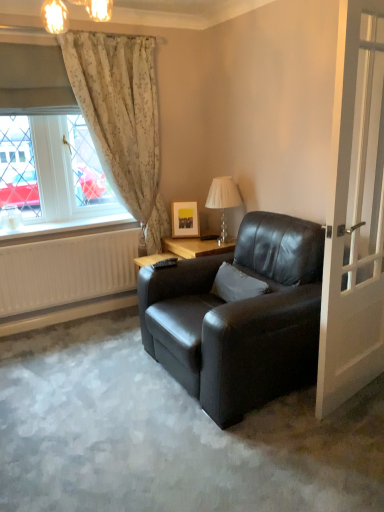
What is the approximate height of matte wooden picture frame at upper right?

12.49 inches.

You are a GUI agent. You are given a task and a screenshot of the screen. Output one action in this format:
    pyautogui.click(x=<x>, y=<y>)
    Task: Click on the matte black armchair at center
    The image size is (384, 512).
    Given the screenshot: What is the action you would take?
    pyautogui.click(x=240, y=318)

In the scene shown: Measure the distance between point (220, 193) and camera.

The distance of point (220, 193) from camera is 3.19 meters.

The width and height of the screenshot is (384, 512). Describe the element at coordinates (55, 16) in the screenshot. I see `matte glass lampshade at upper center` at that location.

This screenshot has width=384, height=512. What are the coordinates of `matte wooden picture frame at upper right` in the screenshot? It's located at (185, 220).

Which is closer to the camera, (110, 11) or (230, 298)?

Positioned in front is point (230, 298).

Can you tell me how much matte glass lampshade at upper center and white soft pillow at center differ in facing direction?

89.4 degrees separate the facing orientations of matte glass lampshade at upper center and white soft pillow at center.

Would you say matte glass lampshade at upper center is a long distance from white soft pillow at center?

Yes.

Between matte glass lampshade at upper center and white soft pillow at center, which one has more height?

Standing taller between the two is white soft pillow at center.

Would you say matte glass lampshade at upper center is a long distance from white floral curtains at upper left?

matte glass lampshade at upper center is actually quite close to white floral curtains at upper left.

Considering the positions of objects matte glass lampshade at upper center and white floral curtains at upper left in the image provided, who is behind, matte glass lampshade at upper center or white floral curtains at upper left?

white floral curtains at upper left.

Can you confirm if matte glass lampshade at upper center is taller than white floral curtains at upper left?

No.

Who is more distant, floral fabric curtain at left or matte black armchair at center?

Positioned behind is floral fabric curtain at left.

Can you tell me how much floral fabric curtain at left and matte black armchair at center differ in facing direction?

The angular difference between floral fabric curtain at left and matte black armchair at center is 90.6 degrees.

Is there a large distance between floral fabric curtain at left and matte black armchair at center?

Absolutely, floral fabric curtain at left is distant from matte black armchair at center.

Which is in front, point (156, 140) or point (304, 309)?

The point (304, 309) is closer to the camera.

What's the angular difference between matte black armchair at center and white matte radiator at lower left's facing directions?

89.9 degrees.

Could you tell me if matte black armchair at center is facing white matte radiator at lower left?

No, matte black armchair at center does not turn towards white matte radiator at lower left.

Between matte black armchair at center and white matte radiator at lower left, which one has larger width?

matte black armchair at center.

Between point (182, 374) and point (51, 247), which one is positioned in front?

The point (182, 374) is closer to the camera.

Consider the image. Can we say matte black armchair at center lies outside white glossy door at right?

Absolutely, matte black armchair at center is external to white glossy door at right.

Which object is further away from the camera taking this photo, matte black armchair at center or white glossy door at right?

matte black armchair at center is more distant.

Looking at this image, considering the relative sizes of matte black armchair at center and white glossy door at right in the image provided, is matte black armchair at center smaller than white glossy door at right?

No.

Does matte black armchair at center appear on the left side of white glossy door at right?

Yes.

Is matte wooden picture frame at upper right further to camera compared to matte glass lampshade at upper center?

Yes, matte wooden picture frame at upper right is behind matte glass lampshade at upper center.

Is matte wooden picture frame at upper right not close to matte glass lampshade at upper center?

matte wooden picture frame at upper right is positioned a significant distance from matte glass lampshade at upper center.

From the image's perspective, relative to matte glass lampshade at upper center, is matte wooden picture frame at upper right above or below?

Clearly, from the image's perspective, matte wooden picture frame at upper right is below matte glass lampshade at upper center.

From a real-world perspective, does matte wooden picture frame at upper right sit lower than matte glass lampshade at upper center?

Yes, from a real-world perspective, matte wooden picture frame at upper right is below matte glass lampshade at upper center.

Can you tell me how much white floral curtains at upper left and matte black armchair at center differ in facing direction?

The angle between the facing direction of white floral curtains at upper left and the facing direction of matte black armchair at center is 90.4 degrees.

From the image's perspective, is white floral curtains at upper left positioned above or below matte black armchair at center?

Based on their image positions, white floral curtains at upper left is located above matte black armchair at center.

Is white floral curtains at upper left surrounding matte black armchair at center?

No, matte black armchair at center is not a part of white floral curtains at upper left.

In the scene shown: Can you confirm if white floral curtains at upper left is bigger than matte black armchair at center?

Incorrect, white floral curtains at upper left is not larger than matte black armchair at center.

This screenshot has width=384, height=512. What are the coordinates of `pillow lying behind the matte glass lampshade at upper center` in the screenshot? It's located at (236, 284).

Identify the location of lamp on the right of white floral curtains at upper left. (55, 16).

Based on their spatial positions, is matte glass lampshade at upper center or matte black armchair at center closer to translucent glass table lamp at upper center?

The object closer to translucent glass table lamp at upper center is matte black armchair at center.

Considering their positions, is white matte radiator at lower left positioned further to matte glass lampshade at upper center than white floral curtains at upper left?

white matte radiator at lower left is positioned further to the anchor matte glass lampshade at upper center.

In the scene shown: Based on their spatial positions, is white glossy door at right or matte wooden picture frame at upper right closer to white floral curtains at upper left?

matte wooden picture frame at upper right is closer to white floral curtains at upper left.

When comparing their distances from matte wooden picture frame at upper right, does white floral curtains at upper left or white matte radiator at lower left seem closer?

white matte radiator at lower left lies closer to matte wooden picture frame at upper right than the other object.

Which object lies nearer to the anchor point floral fabric curtain at left, white floral curtains at upper left or white soft pillow at center?

Based on the image, white floral curtains at upper left appears to be nearer to floral fabric curtain at left.

Which object lies further to the anchor point matte glass lampshade at upper center, white glossy door at right or white floral curtains at upper left?

white glossy door at right is further to matte glass lampshade at upper center.

When comparing their distances from white glossy door at right, does matte black armchair at center or white soft pillow at center seem further?

white soft pillow at center.

Which object lies nearer to the anchor point matte glass lampshade at upper center, matte wooden picture frame at upper right or white matte radiator at lower left?

matte wooden picture frame at upper right.

The width and height of the screenshot is (384, 512). In order to click on window between white matte radiator at lower left and matte black armchair at center in this screenshot , I will do 52,177.

This screenshot has width=384, height=512. I want to click on curtain between white floral curtains at upper left and translucent glass table lamp at upper center in the horizontal direction, so click(x=122, y=118).

Where is `chair located between white matte radiator at lower left and white glossy door at right in the left-right direction`? chair located between white matte radiator at lower left and white glossy door at right in the left-right direction is located at coordinates (240, 318).

Locate an element on the screen. The height and width of the screenshot is (512, 384). table lamp between white glossy door at right and matte wooden picture frame at upper right in the front-back direction is located at coordinates (223, 201).